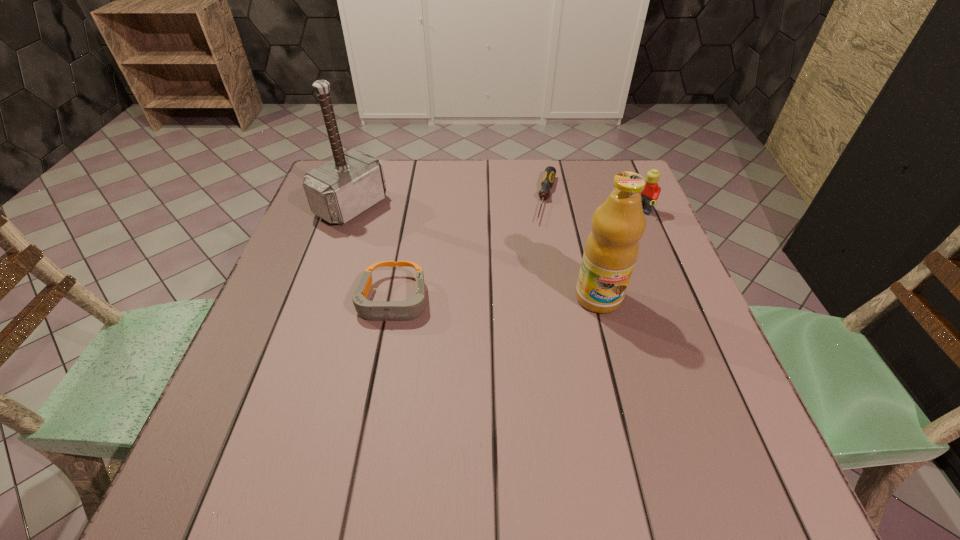
Where is `vacant space in between the olive oil and the shortest object`? The image size is (960, 540). vacant space in between the olive oil and the shortest object is located at coordinates (572, 248).

Image resolution: width=960 pixels, height=540 pixels. Find the location of `object that stands as the third closest to the hammer`. object that stands as the third closest to the hammer is located at coordinates (611, 250).

The image size is (960, 540). Find the location of `the fourth closest object to the rightmost object`. the fourth closest object to the rightmost object is located at coordinates (341, 189).

In order to click on free location that satisfies the following two spatial constraints: 1. on the front side of the hammer; 2. on the left side of the rightmost object in this screenshot , I will do `click(350, 212)`.

Locate an element on the screen. The width and height of the screenshot is (960, 540). vacant region that satisfies the following two spatial constraints: 1. on the front side of the third shortest object; 2. on the right side of the shortest object is located at coordinates (x=549, y=212).